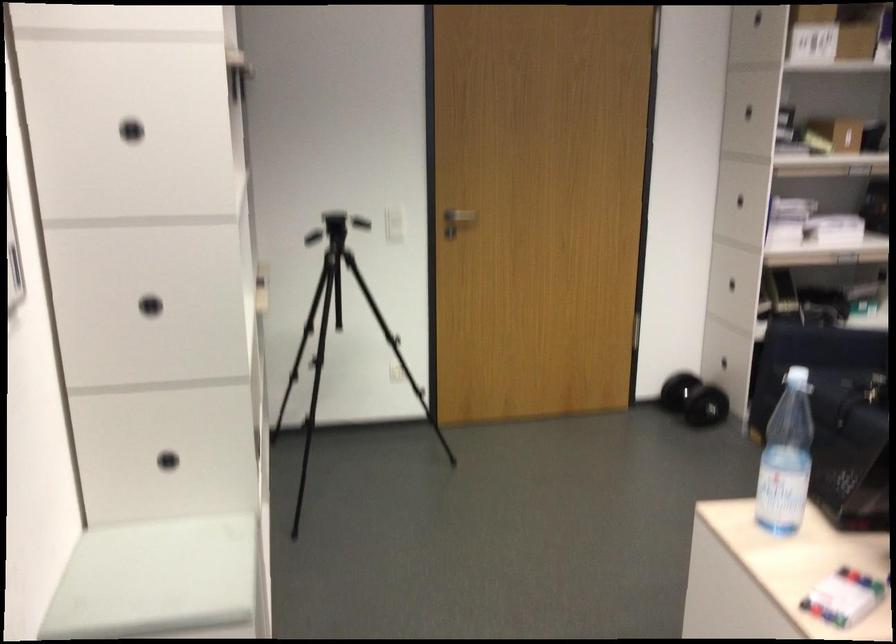
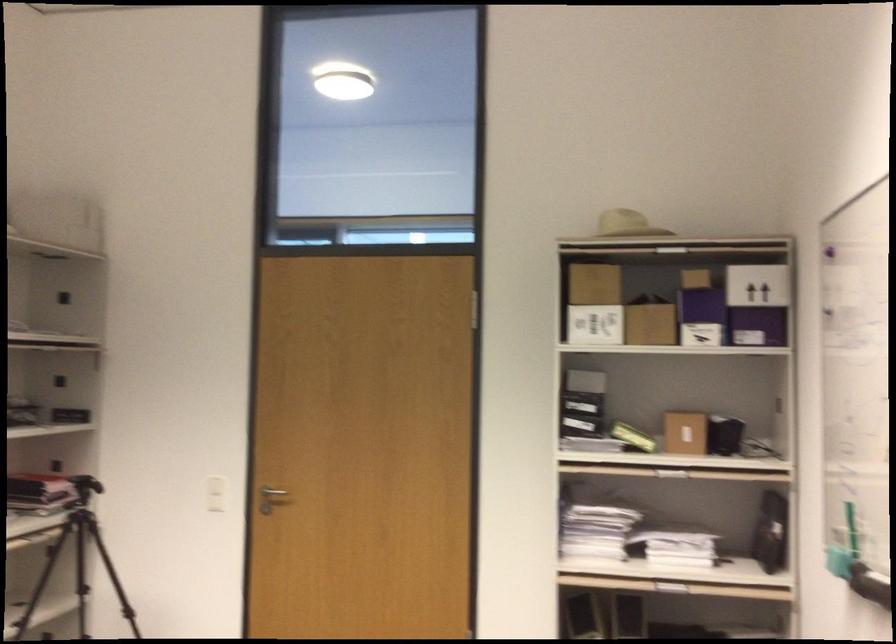
In the second image, find the point that corresponds to [800,147] in the first image.

(633, 437)